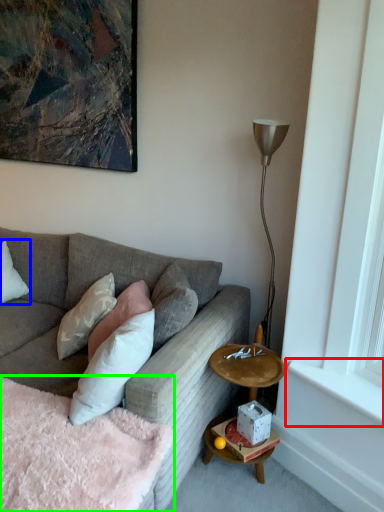
Question: Which object is the farthest from window sill (highlighted by a red box)? Choose among these: pillow (highlighted by a blue box) or bedding (highlighted by a green box).

Choices:
 (A) pillow
 (B) bedding

Answer: (A)